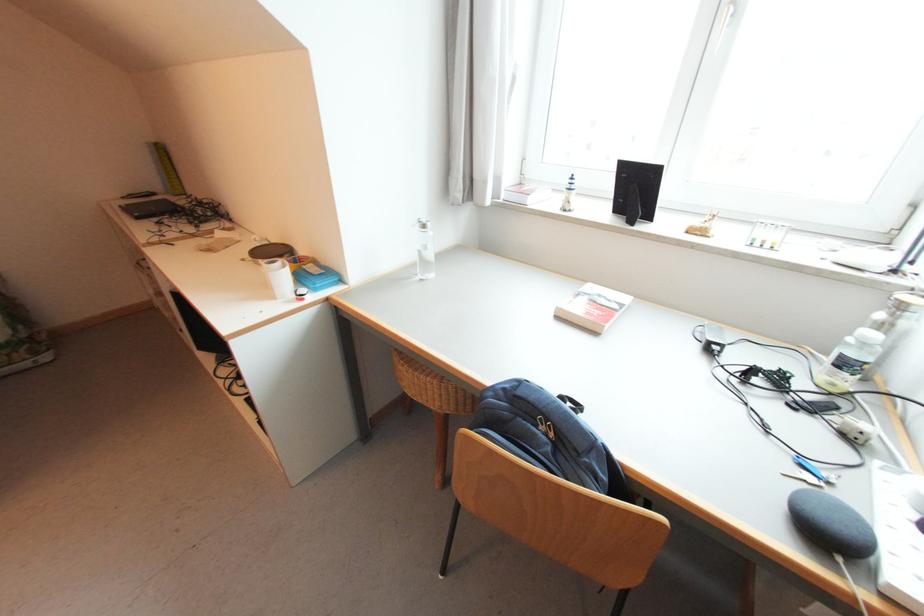
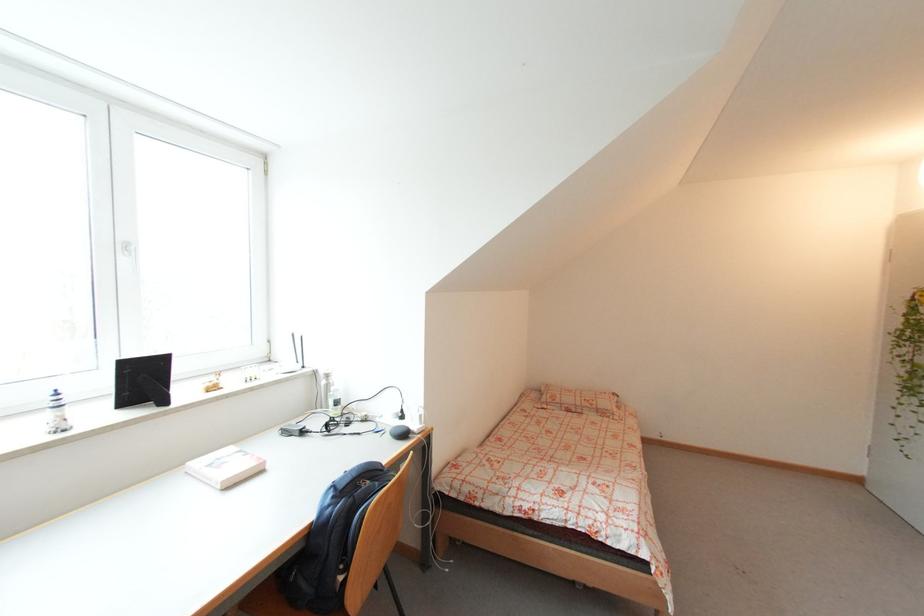
Find the pixel in the second image that matches point 578,177 in the first image.

(58, 392)